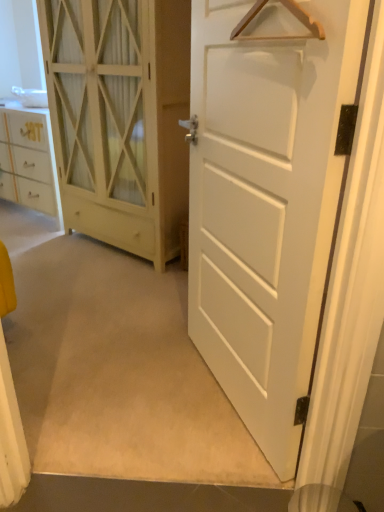
Describe the element at coordinates (120, 118) in the screenshot. Image resolution: width=384 pixels, height=512 pixels. I see `white wood cabinet at left, the 2th door viewed from the front` at that location.

This screenshot has width=384, height=512. Describe the element at coordinates (266, 206) in the screenshot. I see `white matte door at center, which appears as the 1th door when viewed from the front` at that location.

Find the location of a particular element. The image size is (384, 512). wooden hanger at upper center is located at coordinates (279, 36).

From a real-world perspective, is white wood cabinet at left, the 2th door viewed from the front, below white matte door at center, the second door from the back?

Actually, white wood cabinet at left, the 2th door viewed from the front, is physically above white matte door at center, the second door from the back, in the real world.

Is there a large distance between white wood cabinet at left, the 2th door viewed from the front, and white matte door at center, the second door from the back?

Yes.

Does white wood cabinet at left, the 2th door viewed from the front, turn towards white matte door at center, the second door from the back?

No, white wood cabinet at left, the 2th door viewed from the front, is not oriented towards white matte door at center, the second door from the back.

Who is bigger, white wood cabinet at left, placed as the first door when sorted from back to front, or white matte door at center, which appears as the 1th door when viewed from the front?

Bigger between the two is white wood cabinet at left, placed as the first door when sorted from back to front.

Does white matte door at center, the second door from the back, turn towards wooden hanger at upper center?

Yes.

In terms of width, does white matte door at center, which appears as the 1th door when viewed from the front, look wider or thinner when compared to wooden hanger at upper center?

Considering their sizes, white matte door at center, which appears as the 1th door when viewed from the front, looks broader than wooden hanger at upper center.

Does white matte door at center, the second door from the back, touch wooden hanger at upper center?

No, white matte door at center, the second door from the back, is not making contact with wooden hanger at upper center.

From a real-world perspective, is wooden hanger at upper center on top of white wood cabinet at left, the 2th door viewed from the front?

Yes.

Considering the positions of objects wooden hanger at upper center and white wood cabinet at left, the 2th door viewed from the front, in the image provided, who is more to the right, wooden hanger at upper center or white wood cabinet at left, the 2th door viewed from the front,?

wooden hanger at upper center.

Looking at this image, is wooden hanger at upper center shorter than white wood cabinet at left, the 2th door viewed from the front?

Yes, wooden hanger at upper center is shorter than white wood cabinet at left, the 2th door viewed from the front.

Considering their positions, is wooden hanger at upper center located in front of or behind white wood cabinet at left, the 2th door viewed from the front?

In the image, wooden hanger at upper center appears in front of white wood cabinet at left, the 2th door viewed from the front.

Is white wood cabinet at left, placed as the first door when sorted from back to front, wider than wooden hanger at upper center?

Yes.

Is wooden hanger at upper center surrounded by white wood cabinet at left, the 2th door viewed from the front?

No, wooden hanger at upper center is not inside white wood cabinet at left, the 2th door viewed from the front.

Is white wood cabinet at left, placed as the first door when sorted from back to front, positioned with its back to wooden hanger at upper center?

white wood cabinet at left, placed as the first door when sorted from back to front, does not have its back to wooden hanger at upper center.

Can you see white wood cabinet at left, the 2th door viewed from the front, touching wooden hanger at upper center?

They are not placed beside each other.

In the image, is wooden hanger at upper center positioned in front of or behind white matte door at center, the second door from the back?

Clearly, wooden hanger at upper center is in front of white matte door at center, the second door from the back.

Who is bigger, wooden hanger at upper center or white matte door at center, which appears as the 1th door when viewed from the front?

white matte door at center, which appears as the 1th door when viewed from the front, is bigger.

Is wooden hanger at upper center to the right of white matte door at center, which appears as the 1th door when viewed from the front, from the viewer's perspective?

Yes, wooden hanger at upper center is to the right of white matte door at center, which appears as the 1th door when viewed from the front.

Is wooden hanger at upper center positioned with its back to white matte door at center, which appears as the 1th door when viewed from the front?

Yes, wooden hanger at upper center is positioned with its back facing white matte door at center, which appears as the 1th door when viewed from the front.

Could you tell me if white matte door at center, the second door from the back, is facing white wood cabinet at left, the 2th door viewed from the front?

No, white matte door at center, the second door from the back, does not turn towards white wood cabinet at left, the 2th door viewed from the front.

Looking at their sizes, would you say white matte door at center, the second door from the back, is wider or thinner than white wood cabinet at left, placed as the first door when sorted from back to front?

In the image, white matte door at center, the second door from the back, appears to be more narrow than white wood cabinet at left, placed as the first door when sorted from back to front.

Are white matte door at center, the second door from the back, and white wood cabinet at left, the 2th door viewed from the front, making contact?

white matte door at center, the second door from the back, is not next to white wood cabinet at left, the 2th door viewed from the front, and they're not touching.

Is white wood cabinet at left, the 2th door viewed from the front, surrounded by white matte door at center, which appears as the 1th door when viewed from the front?

No, white wood cabinet at left, the 2th door viewed from the front, is not surrounded by white matte door at center, which appears as the 1th door when viewed from the front.

The height and width of the screenshot is (512, 384). What are the coordinates of `door behind the white matte door at center, the second door from the back` in the screenshot? It's located at (120, 118).

This screenshot has height=512, width=384. I want to click on hanger above the white matte door at center, which appears as the 1th door when viewed from the front (from a real-world perspective), so click(279, 36).

From the image, which object appears to be nearer to white matte door at center, the second door from the back, wooden hanger at upper center or white wood cabinet at left, the 2th door viewed from the front?

wooden hanger at upper center is closer to white matte door at center, the second door from the back.

Estimate the real-world distances between objects in this image. Which object is closer to wooden hanger at upper center, white matte door at center, which appears as the 1th door when viewed from the front, or white wood cabinet at left, placed as the first door when sorted from back to front?

The object closer to wooden hanger at upper center is white matte door at center, which appears as the 1th door when viewed from the front.

From the image, which object appears to be nearer to white wood cabinet at left, the 2th door viewed from the front, wooden hanger at upper center or white matte door at center, the second door from the back?

white matte door at center, the second door from the back, lies closer to white wood cabinet at left, the 2th door viewed from the front, than the other object.

Which object lies further to the anchor point wooden hanger at upper center, white wood cabinet at left, the 2th door viewed from the front, or white matte door at center, which appears as the 1th door when viewed from the front?

Among the two, white wood cabinet at left, the 2th door viewed from the front, is located further to wooden hanger at upper center.

Looking at the image, which one is located closer to white wood cabinet at left, the 2th door viewed from the front, white matte door at center, which appears as the 1th door when viewed from the front, or wooden hanger at upper center?

Among the two, white matte door at center, which appears as the 1th door when viewed from the front, is located nearer to white wood cabinet at left, the 2th door viewed from the front.

Based on their spatial positions, is white wood cabinet at left, placed as the first door when sorted from back to front, or wooden hanger at upper center further from white matte door at center, the second door from the back?

white wood cabinet at left, placed as the first door when sorted from back to front.

Locate an element on the screen. The image size is (384, 512). door positioned between wooden hanger at upper center and white wood cabinet at left, the 2th door viewed from the front, from near to far is located at coordinates (266, 206).